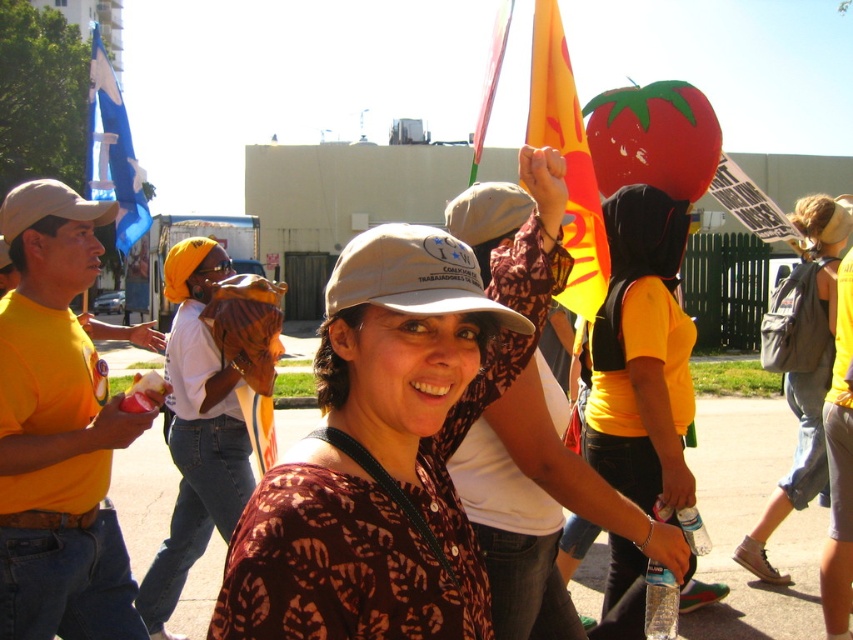
Who is shorter, matte yellow shirt at center or beige fabric baseball cap at left?

beige fabric baseball cap at left

How distant is matte yellow shirt at center from beige fabric baseball cap at left?

matte yellow shirt at center and beige fabric baseball cap at left are 5.18 feet apart from each other.

Is point (474, 428) positioned before point (68, 218)?

Yes, point (474, 428) is in front of point (68, 218).

Image resolution: width=853 pixels, height=640 pixels. Identify the location of matte yellow shirt at center. (531, 502).

Can you confirm if brown printed shirt at center is shorter than blue fabric flag at upper left?

Incorrect, brown printed shirt at center's height does not fall short of blue fabric flag at upper left's.

Between point (437, 592) and point (117, 168), which one is positioned behind?

The point (117, 168) is more distant.

Does point (366, 358) lie behind point (97, 83)?

No.

Locate an element on the screen. brown printed shirt at center is located at coordinates (387, 449).

Is the position of yellow fabric headscarf at center less distant than that of denim shorts at lower right?

That is True.

Find the location of `yellow fabric headscarf at center`. yellow fabric headscarf at center is located at coordinates (204, 417).